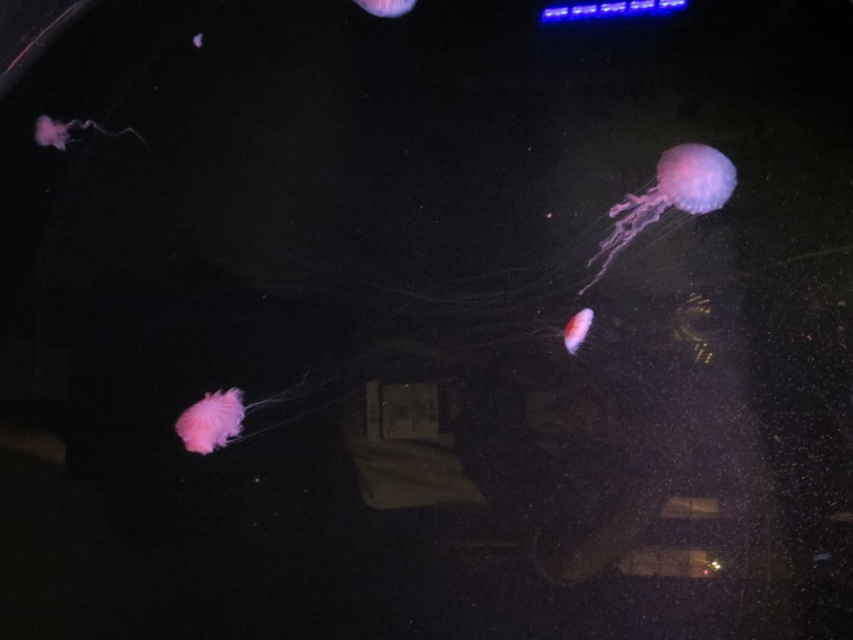
You are an underwater photographer aiming to capture the translucent pink jellyfish at upper left and the translucent pink jellyfish at center in a single frame. Based on their positions, which jellyfish is positioned to the right of the other?

The translucent pink jellyfish at center is positioned to the right of the translucent pink jellyfish at upper left.

You are standing in front of an aquarium and see the translucent pink jellyfish at upper left. If you want to touch it, will you be able to reach it from where you are standing?

The translucent pink jellyfish at upper left is 1.11 meters away from you, so you cannot reach it from where you are standing.